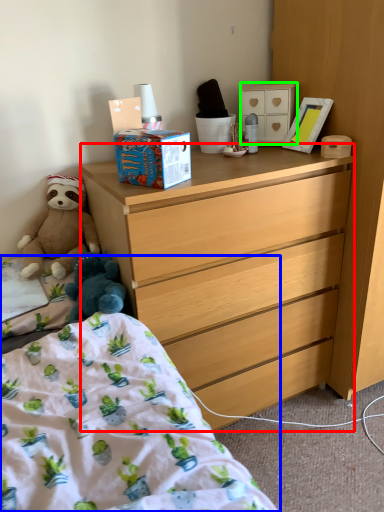
Question: Which object is positioned closest to desk (highlighted by a red box)? Select from bed (highlighted by a blue box) and cabinetry (highlighted by a green box).

Choices:
 (A) bed
 (B) cabinetry

Answer: (A)